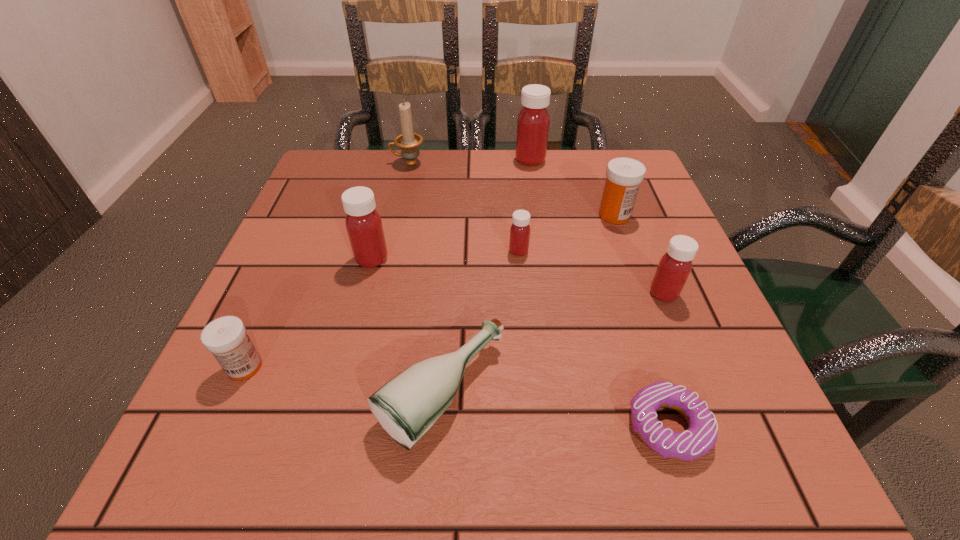
Locate an element on the screen. the nearest medicine is located at coordinates (226, 338).

This screenshot has width=960, height=540. I want to click on the smaller white medicine, so click(226, 338).

Locate an element on the screen. The image size is (960, 540). bottle is located at coordinates (407, 406).

What are the coordinates of `purple doughnut` in the screenshot? It's located at (701, 436).

The image size is (960, 540). I want to click on the shortest object, so click(x=701, y=436).

Locate an element on the screen. Image resolution: width=960 pixels, height=540 pixels. free space located 0.140m on the left of the farthest red medicine is located at coordinates (460, 160).

Identify the location of free space located 0.130m on the handle side of the candle_holder. The image size is (960, 540). (340, 163).

Find the location of a particular element. The height and width of the screenshot is (540, 960). vacant region located 0.140m on the handle side of the candle_holder is located at coordinates (336, 163).

The image size is (960, 540). I want to click on vacant space located 0.180m on the handle side of the candle_holder, so click(x=320, y=163).

This screenshot has width=960, height=540. In order to click on vacant space situated on the left of the fifth shortest medicine in this screenshot , I will do `click(300, 259)`.